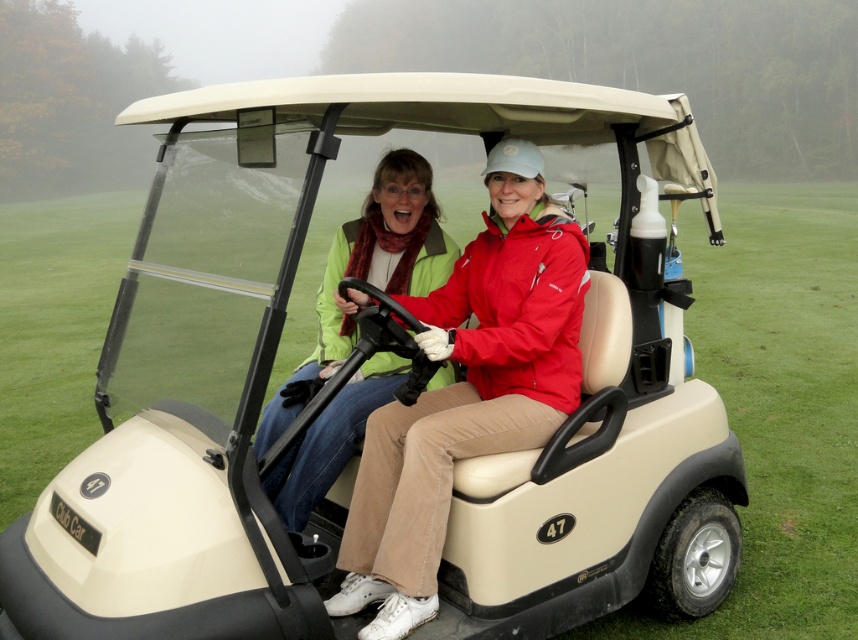
Can you confirm if matte green jacket at center is wider than green matte jacket at center?

Yes, matte green jacket at center is wider than green matte jacket at center.

Is point (502, 221) closer to viewer compared to point (352, 262)?

Yes, point (502, 221) is in front of point (352, 262).

The image size is (858, 640). In order to click on matte green jacket at center in this screenshot , I will do (x=467, y=390).